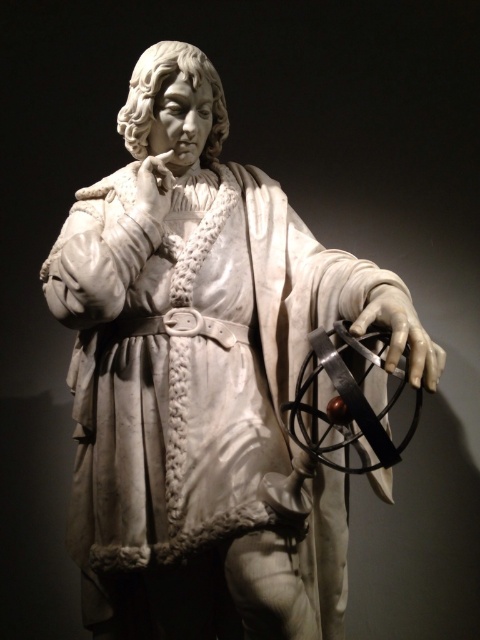
You are an art conservator examining the statue. You notice the white marble sphere at center and the white marble hand at center. Which object is bigger in size?

The white marble sphere at center is larger in size compared to the white marble hand at center.

From the picture: You are an art conservator examining the statue. You notice the white marble sphere at center and the white marble hand at center. Which object is located below the other?

The white marble sphere at center is positioned under the white marble hand at center, so the sphere is below the hand.

You are an art conservator examining the statue. You need to determine the relative positions of the white marble sphere at center and the white marble hand at center. Which one is higher up?

The white marble sphere at center is taller than the white marble hand at center, so the sphere is positioned higher up.